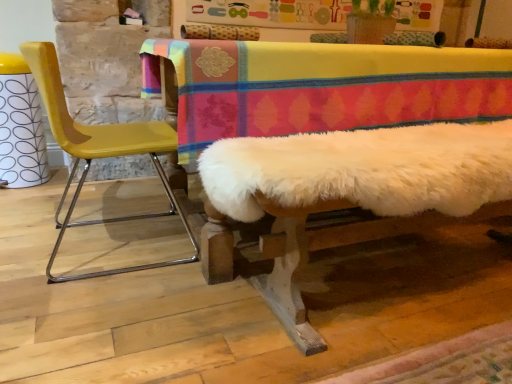
Find the location of a particular element. The image size is (512, 384). free area behind yellow fabric chair at left is located at coordinates tap(121, 201).